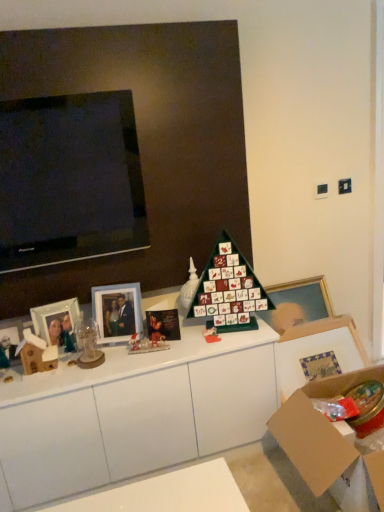
You are a GUI agent. You are given a task and a screenshot of the screen. Output one action in this format:
    pyautogui.click(x=<x>, y=<y>)
    Task: Click on the vacant space to the right of wooden house at left
    This screenshot has height=512, width=384.
    Given the screenshot: What is the action you would take?
    click(x=76, y=372)